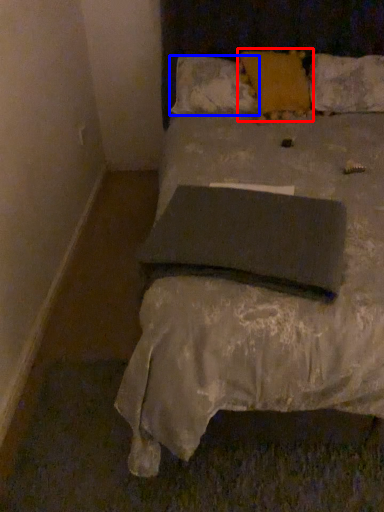
Question: Which object appears farthest to the camera in this image, pillow (highlighted by a red box) or pillow (highlighted by a blue box)?

Choices:
 (A) pillow
 (B) pillow

Answer: (B)